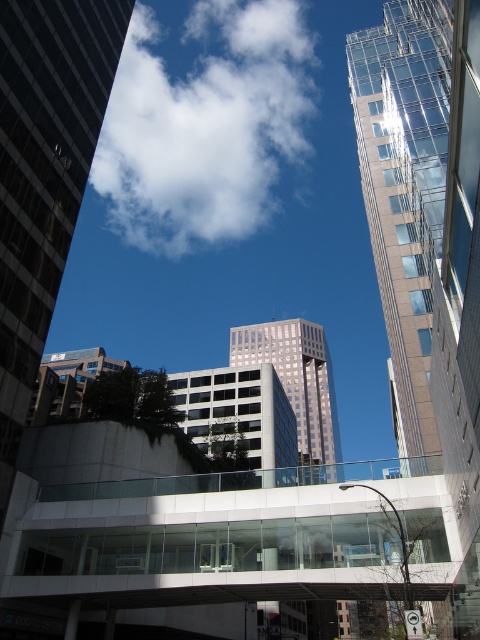
Measure the distance between point [39,228] and camera.

Point [39,228] is 137.86 feet from camera.

Does point (2, 100) come closer to viewer compared to point (386, 36)?

Yes, point (2, 100) is in front of point (386, 36).

Is point (115, 38) closer to viewer compared to point (464, 243)?

That is False.

In order to click on glassy reflective skyscraper at center in this screenshot , I will do `click(44, 173)`.

Does white fluffy cloud at upper center have a lesser width compared to glassy reflective skyscraper at center?

In fact, white fluffy cloud at upper center might be wider than glassy reflective skyscraper at center.

Is the position of white fluffy cloud at upper center more distant than that of glassy reflective skyscraper at center?

Yes.

Where is `white fluffy cloud at upper center`? The image size is (480, 640). white fluffy cloud at upper center is located at coordinates (204, 125).

Is white fluffy cloud at upper center smaller than clear glass skyscraper at upper right?

No, white fluffy cloud at upper center is not smaller than clear glass skyscraper at upper right.

Which is above, white fluffy cloud at upper center or clear glass skyscraper at upper right?

white fluffy cloud at upper center is higher up.

The width and height of the screenshot is (480, 640). What do you see at coordinates (204, 125) in the screenshot?
I see `white fluffy cloud at upper center` at bounding box center [204, 125].

Find the location of a particular element. The image size is (480, 640). white fluffy cloud at upper center is located at coordinates (204, 125).